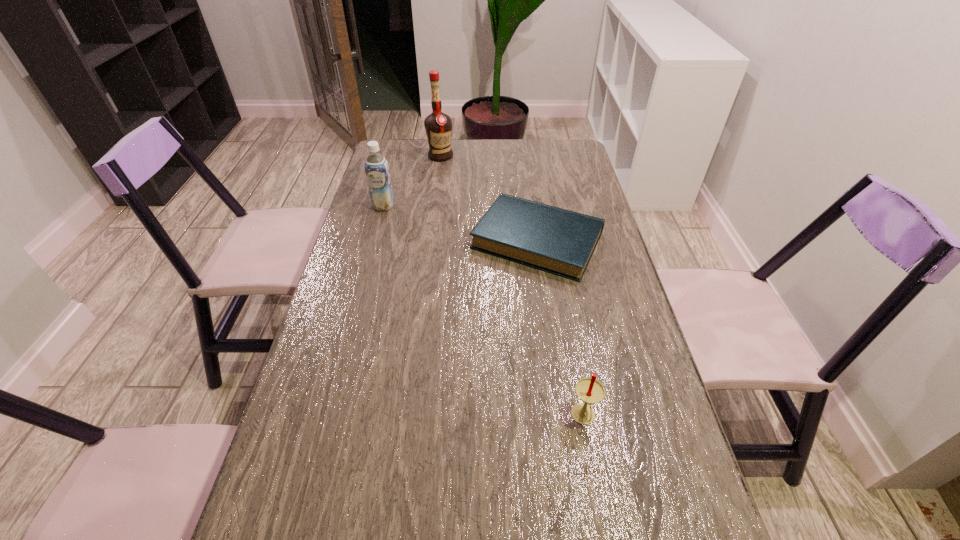
Find the location of a particular element. vacant space located on the left of the shortest object is located at coordinates (427, 240).

Identify the location of object that is at the far edge. (438, 126).

The width and height of the screenshot is (960, 540). I want to click on object located at the left edge, so click(x=377, y=172).

Find the location of a particular element. candle located at the right edge is located at coordinates (589, 390).

The height and width of the screenshot is (540, 960). What are the coordinates of `book that is at the right edge` in the screenshot? It's located at (559, 241).

Locate an element on the screen. Image resolution: width=960 pixels, height=540 pixels. vacant space at the far edge of the desktop is located at coordinates [x=421, y=167].

Identify the location of free space at the left edge. (325, 455).

In the image, there is a desktop. Where is `vacant space at the right edge`? Image resolution: width=960 pixels, height=540 pixels. vacant space at the right edge is located at coordinates (582, 309).

In the image, there is a desktop. Identify the location of vacant space at the far right corner. (576, 145).

Locate an element on the screen. free space between the third tallest object and the shortest object is located at coordinates (561, 329).